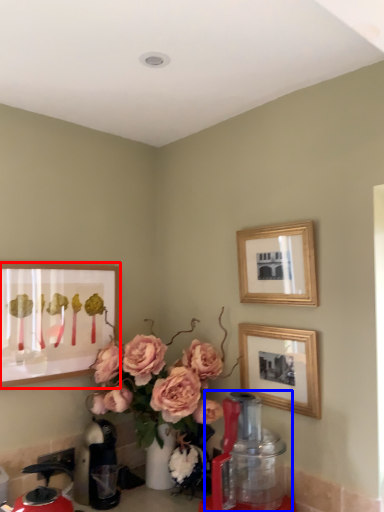
Question: Which of the following is the farthest to the observer, picture frame (highlighted by a red box) or blender (highlighted by a blue box)?

Choices:
 (A) picture frame
 (B) blender

Answer: (A)